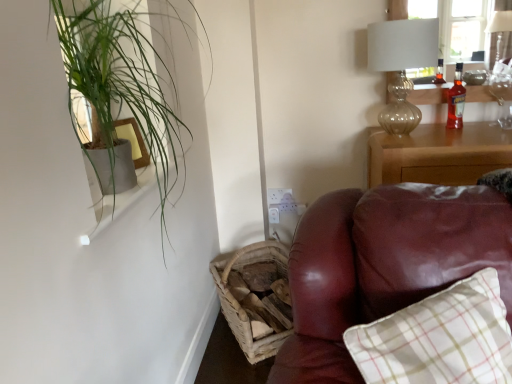
Question: From the image's perspective, would you say white glossy window sill at upper left is positioned over woven wood basket at lower left?

Choices:
 (A) no
 (B) yes

Answer: (B)

Question: From the image's perspective, is white glossy window sill at upper left under woven wood basket at lower left?

Choices:
 (A) no
 (B) yes

Answer: (A)

Question: Is white glossy window sill at upper left not near woven wood basket at lower left?

Choices:
 (A) no
 (B) yes

Answer: (A)

Question: From a real-world perspective, is white glossy window sill at upper left beneath woven wood basket at lower left?

Choices:
 (A) no
 (B) yes

Answer: (A)

Question: Is white glossy window sill at upper left positioned before woven wood basket at lower left?

Choices:
 (A) yes
 (B) no

Answer: (A)

Question: Can you confirm if white glossy window sill at upper left is bigger than woven wood basket at lower left?

Choices:
 (A) yes
 (B) no

Answer: (B)

Question: From a real-world perspective, is wooden nightstand at right beneath green leafy plant at upper left?

Choices:
 (A) no
 (B) yes

Answer: (B)

Question: Considering the relative sizes of wooden nightstand at right and green leafy plant at upper left in the image provided, is wooden nightstand at right smaller than green leafy plant at upper left?

Choices:
 (A) yes
 (B) no

Answer: (A)

Question: Is green leafy plant at upper left at the back of wooden nightstand at right?

Choices:
 (A) no
 (B) yes

Answer: (A)

Question: Considering the relative positions of wooden nightstand at right and green leafy plant at upper left in the image provided, is wooden nightstand at right to the right of green leafy plant at upper left from the viewer's perspective?

Choices:
 (A) no
 (B) yes

Answer: (B)

Question: Considering the relative sizes of wooden nightstand at right and green leafy plant at upper left in the image provided, is wooden nightstand at right wider than green leafy plant at upper left?

Choices:
 (A) yes
 (B) no

Answer: (A)

Question: Is wooden nightstand at right not within green leafy plant at upper left?

Choices:
 (A) no
 (B) yes

Answer: (B)

Question: Is the depth of translucent amber glass bottle at upper right greater than that of translucent glass table lamp at upper right?

Choices:
 (A) yes
 (B) no

Answer: (A)